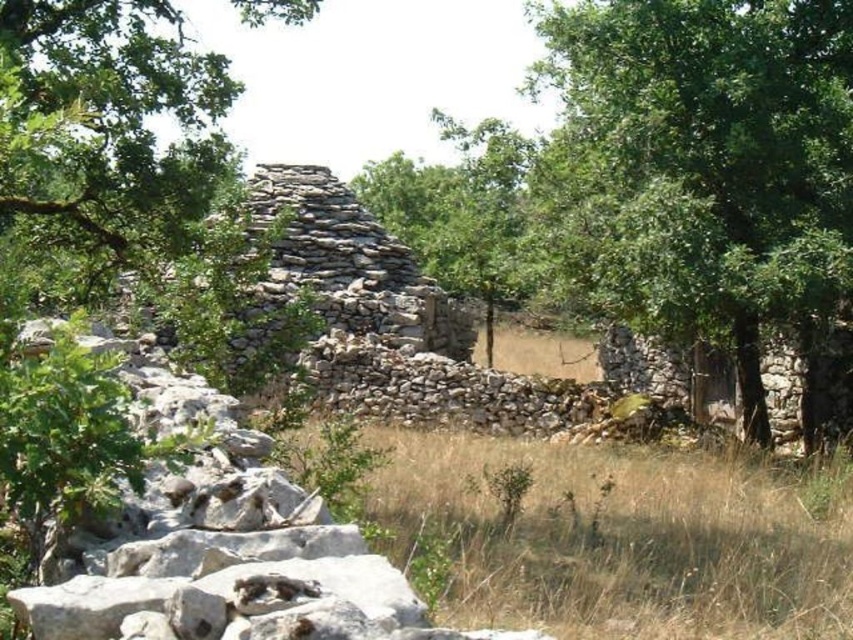
The image size is (853, 640). What do you see at coordinates (666, 182) in the screenshot?
I see `green leafy tree at center` at bounding box center [666, 182].

Does green leafy tree at center appear over dry grass at center?

Yes.

The image size is (853, 640). What are the coordinates of `green leafy tree at center` in the screenshot? It's located at (666, 182).